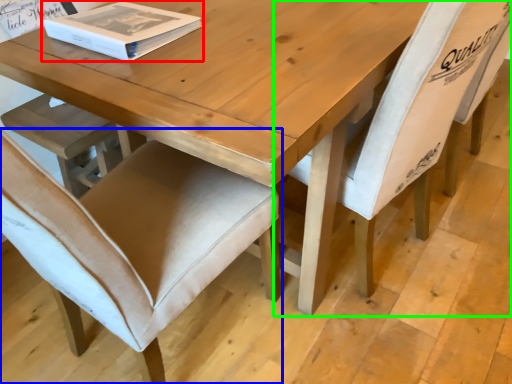
Question: Which object is positioned closest to box (highlighted by a red box)? Select from chair (highlighted by a blue box) and chair (highlighted by a green box).

Choices:
 (A) chair
 (B) chair

Answer: (A)